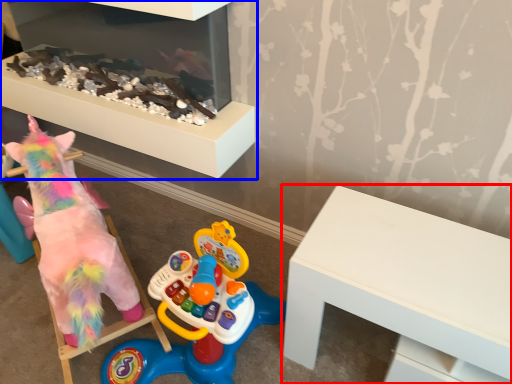
Question: Which point is closer to the camera, table (highlighted by a red box) or furniture (highlighted by a blue box)?

Choices:
 (A) table
 (B) furniture

Answer: (A)